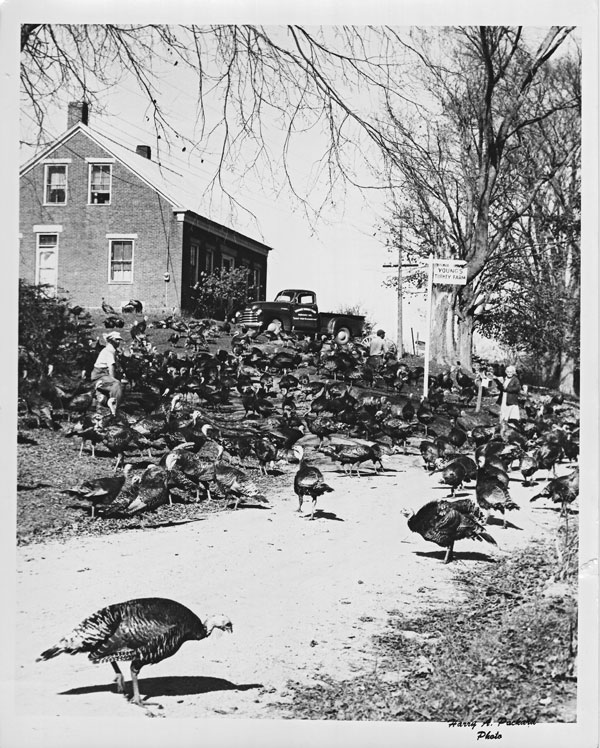
The height and width of the screenshot is (748, 600). Find the location of `windows on bottom floor`. windows on bottom floor is located at coordinates (119, 260), (193, 262), (208, 265), (224, 265), (247, 272), (260, 280).